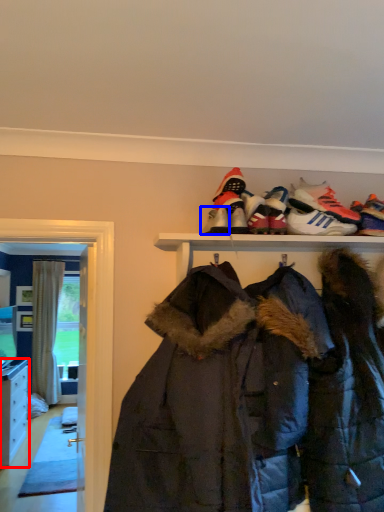
Question: Among these objects, which one is nearest to the camera, cabinetry (highlighted by a red box) or footwear (highlighted by a blue box)?

Choices:
 (A) cabinetry
 (B) footwear

Answer: (B)